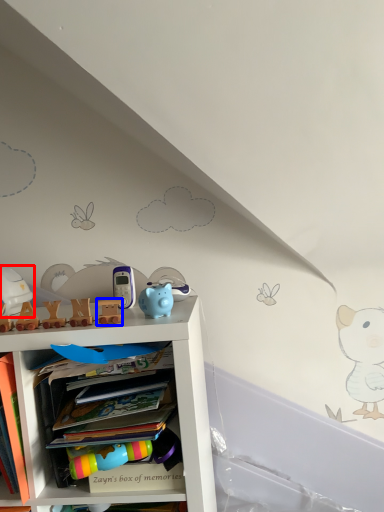
Question: Which point is closer to the camera, toy (highlighted by a red box) or toy (highlighted by a blue box)?

Choices:
 (A) toy
 (B) toy

Answer: (B)